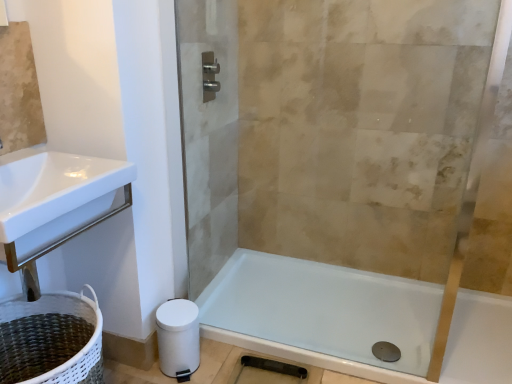
Locate an element on the screen. free spot above white matte toilet paper at lower left (from a real-world perspective) is located at coordinates (176, 315).